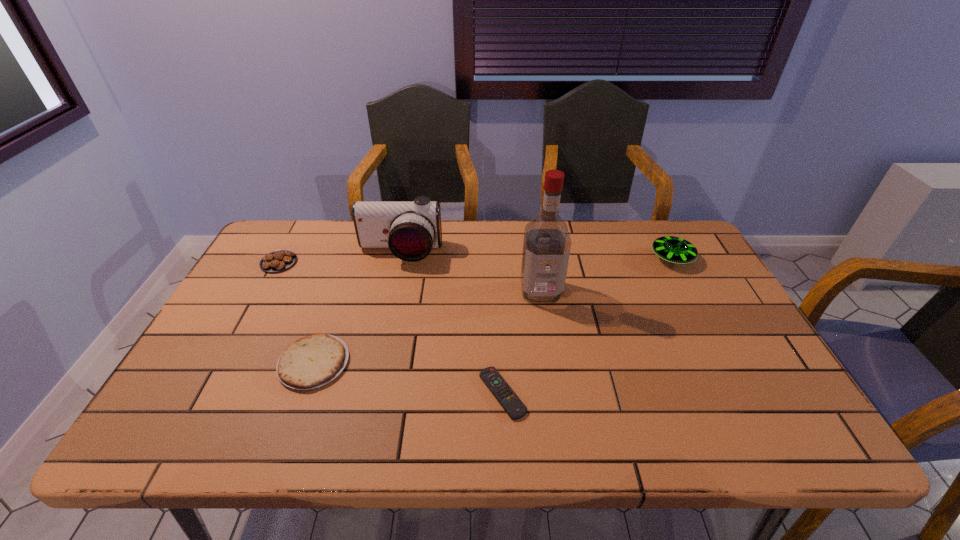
The width and height of the screenshot is (960, 540). What are the coordinates of `vacant space that is in between the shortest object and the fifth tallest object` in the screenshot? It's located at (408, 378).

The image size is (960, 540). What are the coordinates of `free spot between the fifth shortest object and the second shortest object` in the screenshot? It's located at (357, 308).

Locate an element on the screen. The width and height of the screenshot is (960, 540). vacant area that lies between the leftmost object and the fourth shortest object is located at coordinates (475, 260).

Find the location of a particular element. vacant area that lies between the fifth tallest object and the fifth object from left to right is located at coordinates (427, 327).

This screenshot has height=540, width=960. Find the location of `free area in between the pastry and the liquor`. free area in between the pastry and the liquor is located at coordinates (410, 277).

This screenshot has height=540, width=960. What are the coordinates of `free space that is in between the fifth tallest object and the pastry` in the screenshot? It's located at (297, 312).

Identify which object is the fourth nearest to the second tallest object. Please provide its 2D coordinates. Your answer should be formatted as a tuple, i.e. [(x, y)], where the tuple contains the x and y coordinates of a point satisfying the conditions above.

[(511, 403)]

Where is `object that is the second nearest to the remote control`? The width and height of the screenshot is (960, 540). object that is the second nearest to the remote control is located at coordinates (312, 361).

At what (x,y) coordinates should I click in order to perform the action: click on free space that satisfies the following two spatial constraints: 1. on the surface of the fifth shortest object; 2. on the right side of the third object from right to left. Please return your answer as a coordinate pair (x, y). Looking at the image, I should click on (369, 393).

Identify the location of vacant point that satisfies the following two spatial constraints: 1. on the surface of the third tallest object; 2. on the left side of the second tallest object. (398, 259).